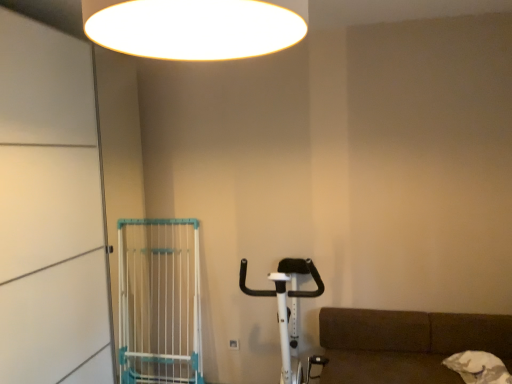
Question: Would you consider white plastic gate at left to be distant from white plastic screen door at left?

Choices:
 (A) yes
 (B) no

Answer: (B)

Question: Is white plastic gate at left wider than white plastic screen door at left?

Choices:
 (A) yes
 (B) no

Answer: (B)

Question: Can you confirm if white plastic gate at left is positioned to the right of white plastic screen door at left?

Choices:
 (A) yes
 (B) no

Answer: (A)

Question: Is white plastic gate at left positioned beyond the bounds of white plastic screen door at left?

Choices:
 (A) yes
 (B) no

Answer: (B)

Question: Does white plastic gate at left have a greater height compared to white plastic screen door at left?

Choices:
 (A) no
 (B) yes

Answer: (A)

Question: Does white plastic gate at left have a lesser width compared to white plastic screen door at left?

Choices:
 (A) no
 (B) yes

Answer: (B)

Question: Does white plastic gate at left have a lesser height compared to white glossy ceiling light at upper center?

Choices:
 (A) yes
 (B) no

Answer: (B)

Question: Can you confirm if white plastic gate at left is taller than white glossy ceiling light at upper center?

Choices:
 (A) yes
 (B) no

Answer: (A)

Question: Is white plastic gate at left to the left of white glossy ceiling light at upper center from the viewer's perspective?

Choices:
 (A) no
 (B) yes

Answer: (B)

Question: Is white plastic gate at left at the right side of white glossy ceiling light at upper center?

Choices:
 (A) no
 (B) yes

Answer: (A)

Question: Can we say white plastic gate at left lies outside white glossy ceiling light at upper center?

Choices:
 (A) no
 (B) yes

Answer: (B)

Question: From a real-world perspective, is white plastic gate at left below white glossy ceiling light at upper center?

Choices:
 (A) yes
 (B) no

Answer: (A)

Question: Is white glossy ceiling light at upper center not within white plastic screen door at left?

Choices:
 (A) no
 (B) yes

Answer: (B)